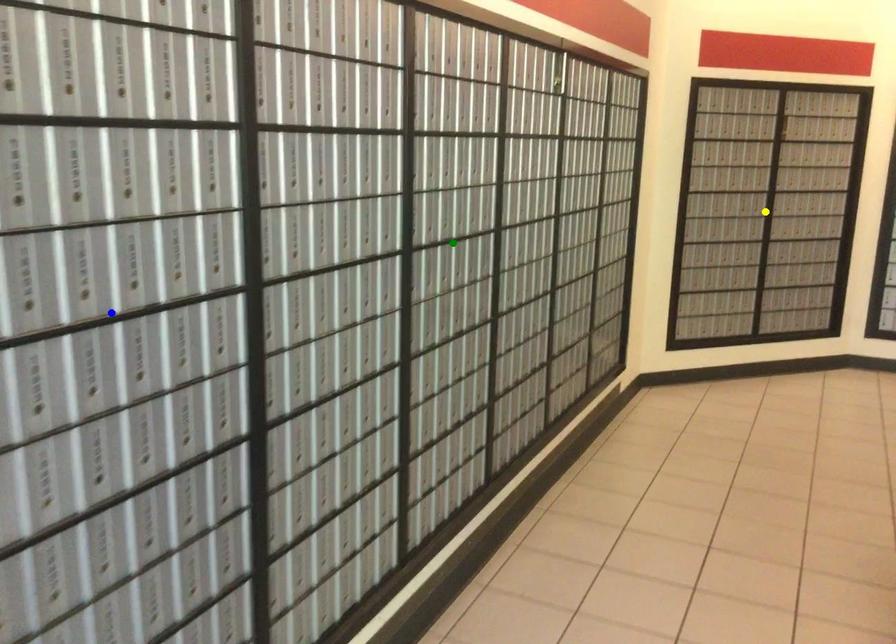
Order these from nearest to farthest:
- green point
- blue point
- yellow point

1. blue point
2. green point
3. yellow point